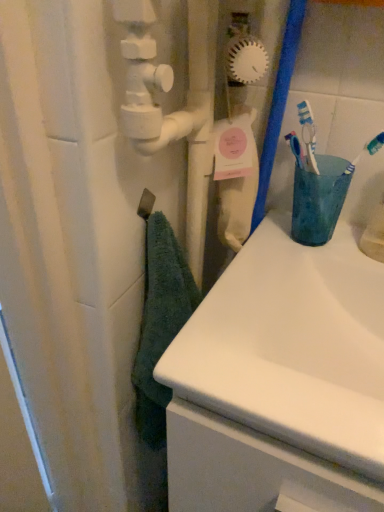
Question: Is matte plastic cup at right wider than teal soft towel at left?

Choices:
 (A) yes
 (B) no

Answer: (A)

Question: From the image's perspective, is matte plastic cup at right on teal soft towel at left?

Choices:
 (A) no
 (B) yes

Answer: (B)

Question: Is matte plastic cup at right not inside teal soft towel at left?

Choices:
 (A) yes
 (B) no

Answer: (A)

Question: Could you tell me if matte plastic cup at right is facing teal soft towel at left?

Choices:
 (A) no
 (B) yes

Answer: (A)

Question: Is matte plastic cup at right positioned far away from teal soft towel at left?

Choices:
 (A) yes
 (B) no

Answer: (B)

Question: Considering the relative positions of matte plastic cup at right and white glossy sink at center in the image provided, is matte plastic cup at right to the left or to the right of white glossy sink at center?

Choices:
 (A) right
 (B) left

Answer: (A)

Question: In terms of width, does matte plastic cup at right look wider or thinner when compared to white glossy sink at center?

Choices:
 (A) wide
 (B) thin

Answer: (B)

Question: Looking at the image, does matte plastic cup at right seem bigger or smaller compared to white glossy sink at center?

Choices:
 (A) big
 (B) small

Answer: (B)

Question: Would you say matte plastic cup at right is inside or outside white glossy sink at center?

Choices:
 (A) outside
 (B) inside

Answer: (A)

Question: From a real-world perspective, relative to matte plastic cup at right, is white glossy sink at center vertically above or below?

Choices:
 (A) above
 (B) below

Answer: (B)

Question: In the image, is white glossy sink at center positioned in front of or behind matte plastic cup at right?

Choices:
 (A) behind
 (B) front

Answer: (B)

Question: From the image's perspective, is white glossy sink at center above or below matte plastic cup at right?

Choices:
 (A) below
 (B) above

Answer: (A)

Question: Considering the positions of white glossy sink at center and matte plastic cup at right in the image, is white glossy sink at center bigger or smaller than matte plastic cup at right?

Choices:
 (A) small
 (B) big

Answer: (B)

Question: Considering the relative positions of teal soft towel at left and white glossy sink at center in the image provided, is teal soft towel at left to the left or to the right of white glossy sink at center?

Choices:
 (A) left
 (B) right

Answer: (A)

Question: Considering the positions of teal soft towel at left and white glossy sink at center in the image, is teal soft towel at left taller or shorter than white glossy sink at center?

Choices:
 (A) short
 (B) tall

Answer: (B)